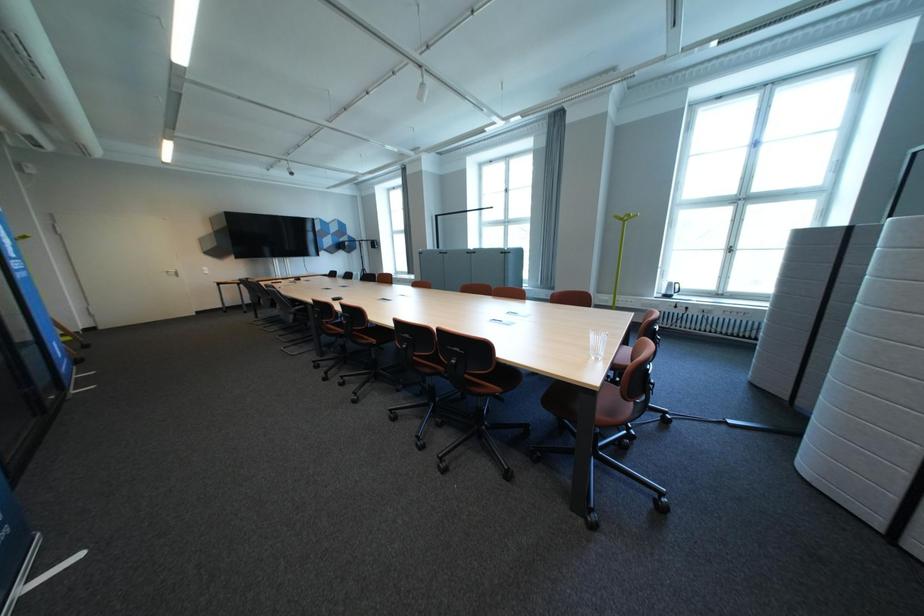
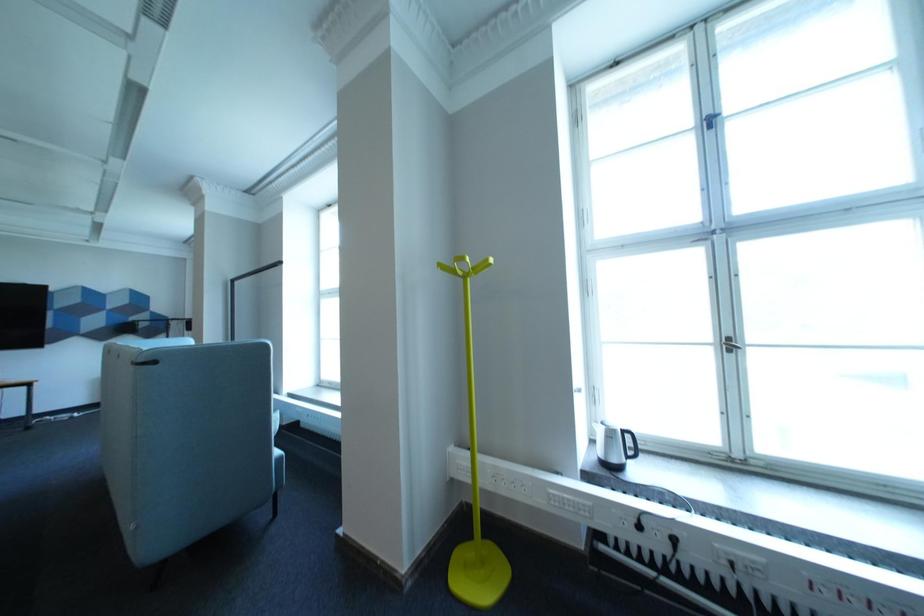
From the picture: Which direction would the cameraman need to move to produce the second image?

The cameraman walked toward right, forward.